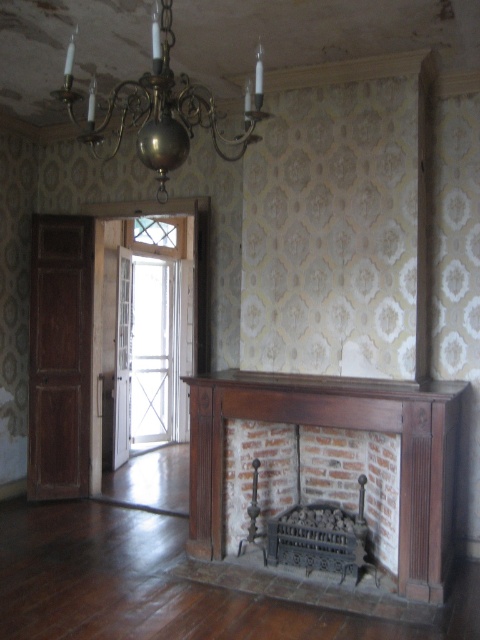
Question: Is brick fireplace at center positioned behind brass/copper chandelier at upper center?

Choices:
 (A) yes
 (B) no

Answer: (A)

Question: Which point is farther from the camera taking this photo?

Choices:
 (A) (437, 484)
 (B) (233, 518)

Answer: (B)

Question: Which of the following is the farthest from the observer?

Choices:
 (A) brown wooden fireplace at center
 (B) brass/copper chandelier at upper center
 (C) brick fireplace at center

Answer: (C)

Question: Does brown wooden fireplace at center appear on the right side of brick fireplace at center?

Choices:
 (A) no
 (B) yes

Answer: (B)

Question: Which of the following is the closest to the observer?

Choices:
 (A) [x=94, y=152]
 (B) [x=276, y=504]

Answer: (B)

Question: Can you confirm if brown wooden fireplace at center is smaller than brass/copper chandelier at upper center?

Choices:
 (A) no
 (B) yes

Answer: (B)